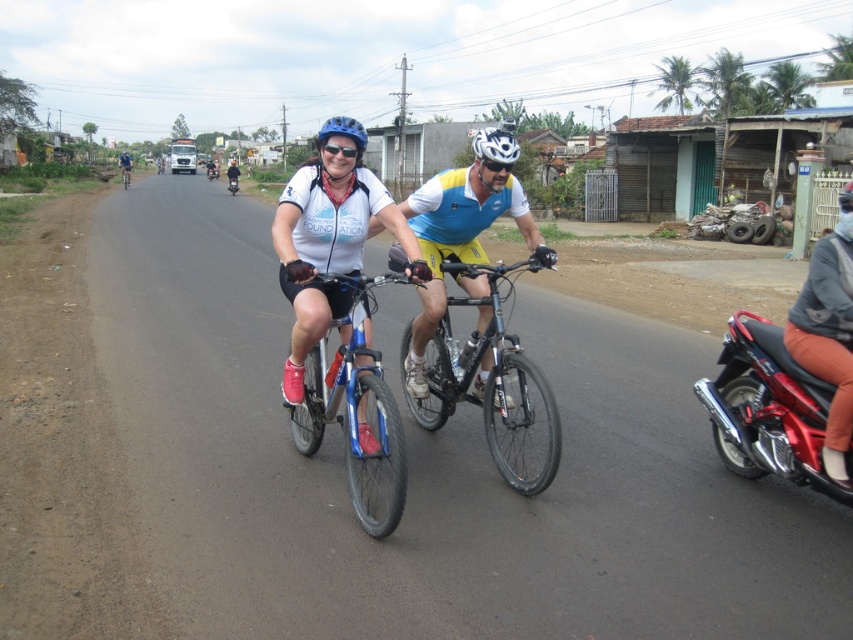
You are a cyclist approaching the matte blue bicycle at center. What is the direction you should turn to reach the point marked at coordinate (370, 234)?

The point marked at coordinate (370, 234) is already the location of the matte blue bicycle at center, so no turn is needed.